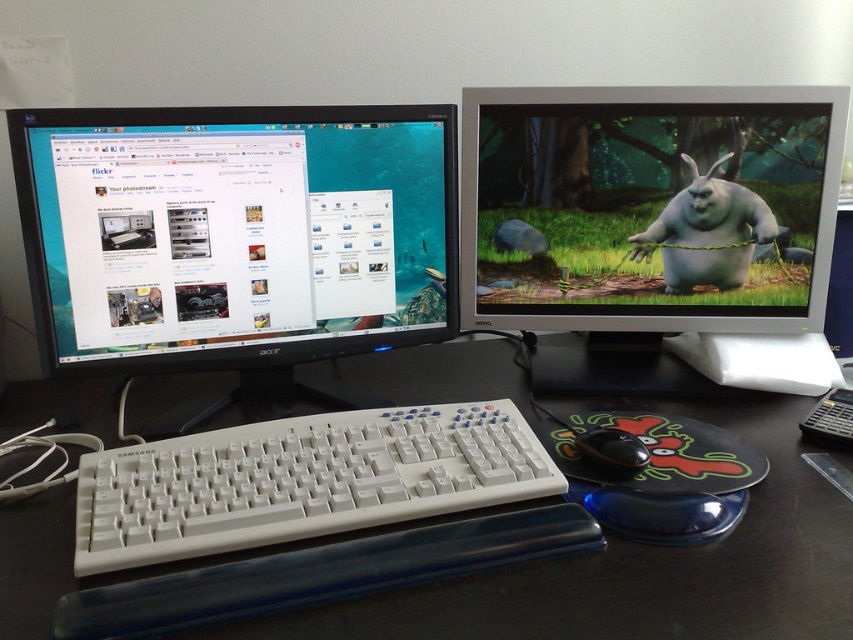
You are setting up a new webcam for your workspace. The webcam needs to be placed on the desk such that it can capture both the matte plastic monitor at right and the keyboard. According to the desk layout, where should you position the webcam to ensure both objects are in frame?

The matte plastic monitor at right is located at point [648,205], so positioning the webcam centrally between the matte plastic monitor at right and the keyboard would ensure both are captured in the frame.

You are setting up a new monitor on your desk. The current setup has a black glossy monitor at left. Where should you place the new monitor to avoid overlapping with the existing one?

The black glossy monitor at left is located at point (x=235, y=230). To avoid overlapping, place the new monitor in an area of the desk that does not intersect with this coordinate.